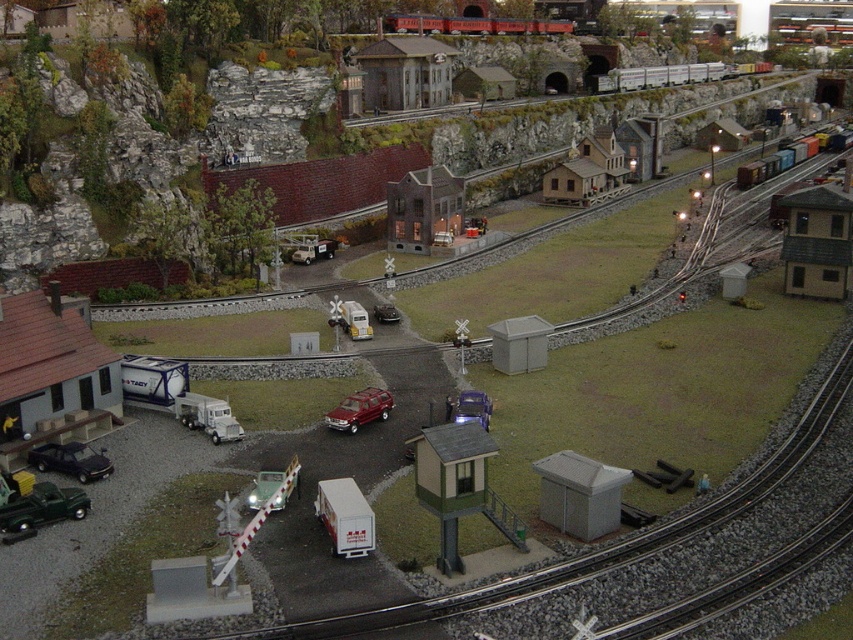
You are a model railway enthusiast inspecting the layout. You notice the metallic red train car at upper center and the metal freight train at upper right. Which of these two trains is shorter in height?

The metallic red train car at upper center is not as tall as the metal freight train at upper right, so the metallic red train car at upper center is shorter in height.

From the picture: You are a model railway enthusiast examining the scene. You notice a metallic red train car at upper center and a metallic red suv at center. Which object is placed higher in the scene?

The metallic red train car at upper center is positioned over the metallic red suv at center, so it is higher in the scene.

You are a model railway enthusiast examining the scene. You need to place a new miniature tree exactly at the coordinate point specified for the metallic red train car at upper center. Is this possible without overlapping the train car?

The metallic red train car at upper center is located at point (474, 26). Since the tree would be placed at the same coordinates, it would overlap with the train car, making it impossible to place the tree there without overlapping.